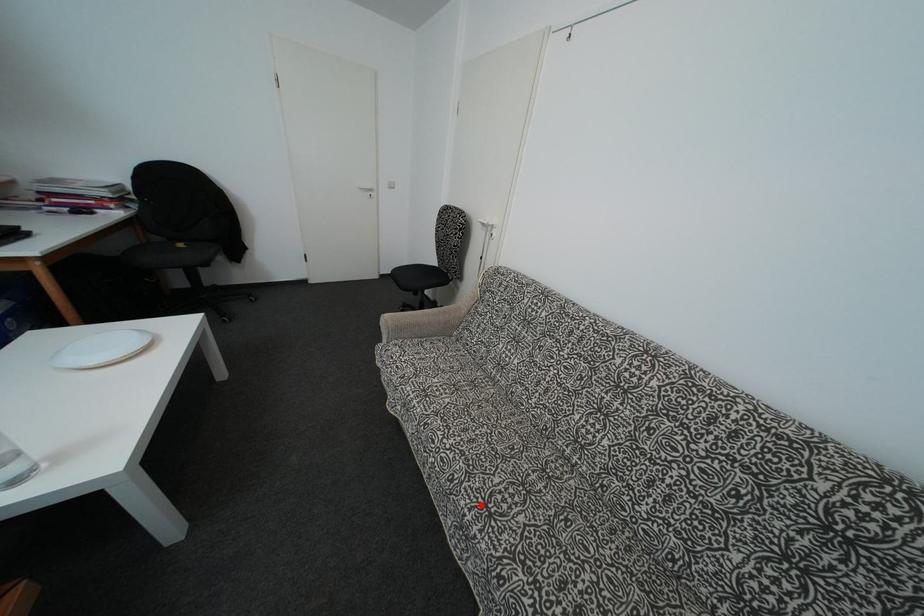
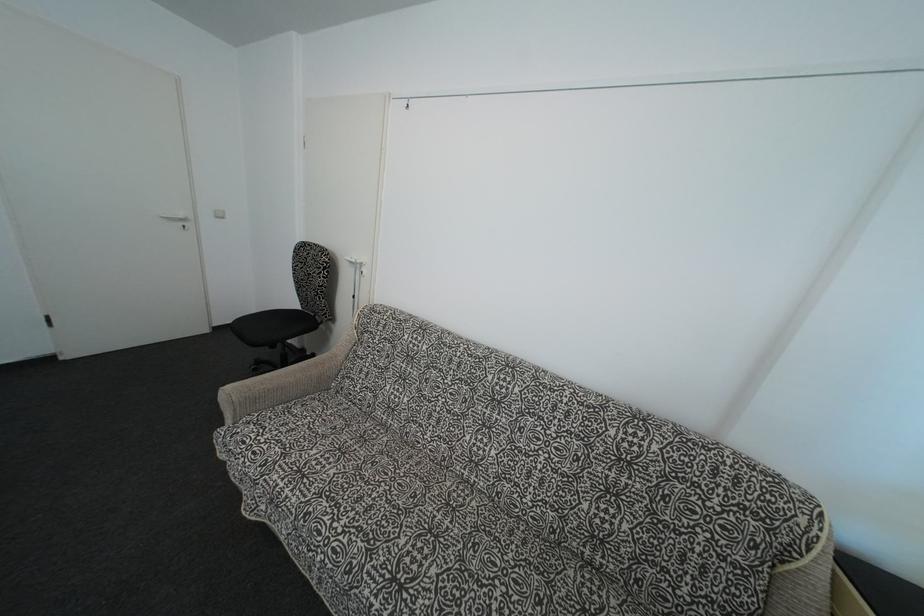
Where in the second image is the point corresponding to the highlighted location from the first image?

(387, 583)